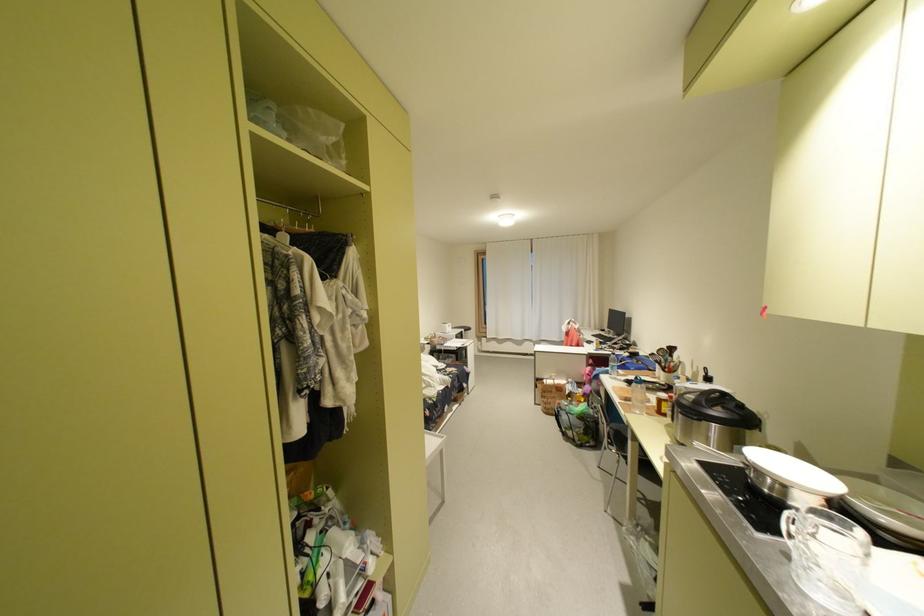
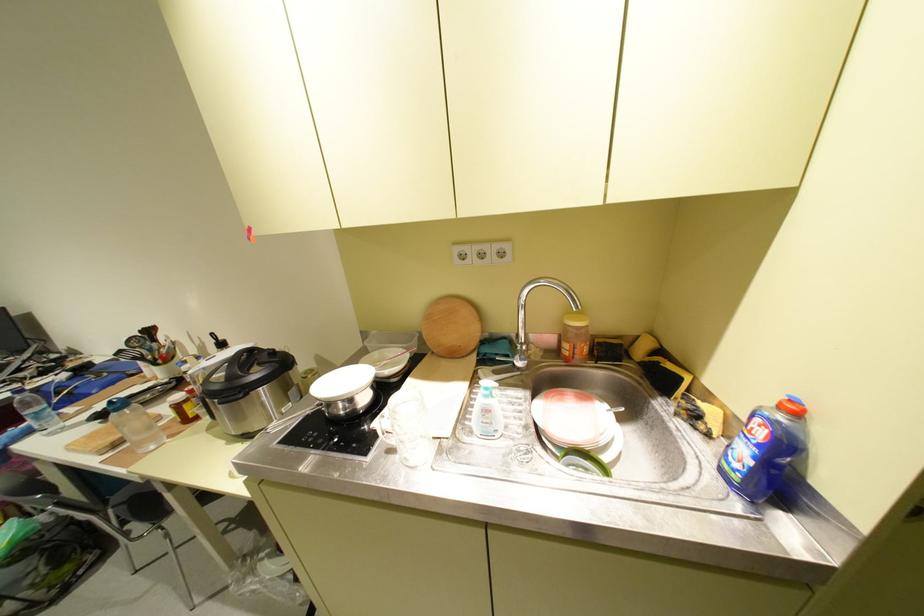
The first image is from the beginning of the video and the second image is from the end. How did the camera likely rotate when shooting the video?

The camera's rotation is toward right-down.